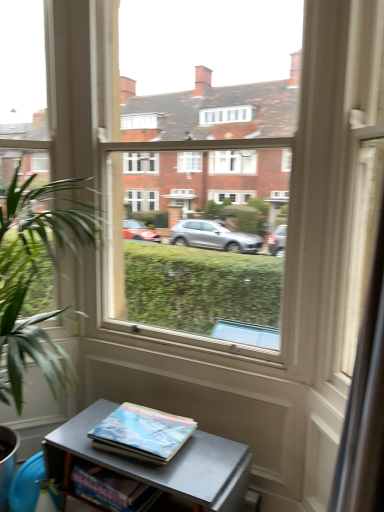
You are a GUI agent. You are given a task and a screenshot of the screen. Output one action in this format:
    pyautogui.click(x=<x>, y=<y>)
    Task: Click on the empty space that is ontop of hardcover book at center, the second book ordered from the bottom (from a real-world perspective)
    
    Given the screenshot: What is the action you would take?
    pos(146,425)